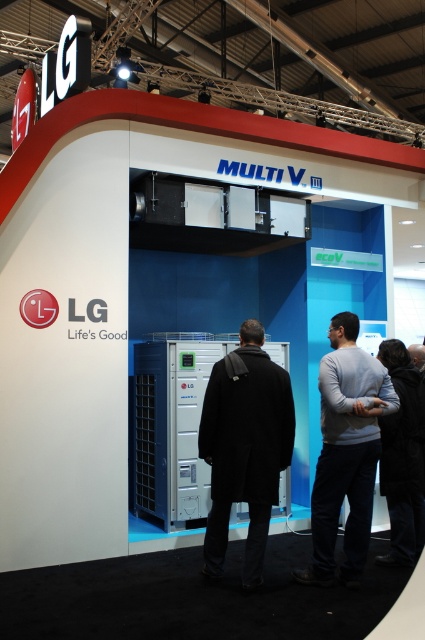
Based on the photo, you are a fashion designer attending a trade show and see the black matte jacket at center and the black fabric jacket at lower right displayed in the LG booth. Which jacket do you think is bigger in size?

The black matte jacket at center is larger in size compared to the black fabric jacket at lower right.

You are a fashion designer observing the LG exhibition booth. You notice the gray sweater at center and the black fabric jacket at lower right. Which clothing item is closer to the front of the booth?

The gray sweater at center is in front of the black fabric jacket at lower right, so it is closer to the front of the booth.

You are an event organizer at the LG booth and need to place a new promotional banner between the gray sweater at center and the black fabric jacket at lower right. Based on their widths, which object should you align the banner closer to for it to fit properly?

The gray sweater at center might be wider than the black fabric jacket at lower right, so aligning the banner closer to the black fabric jacket at lower right would leave enough space for the wider gray sweater at center.